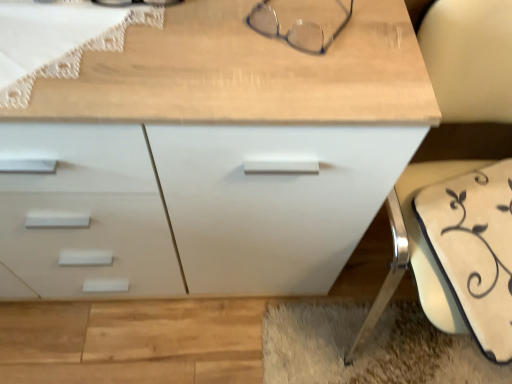
Describe the element at coordinates (246, 74) in the screenshot. This screenshot has width=512, height=384. I see `white matte chest of drawers at center` at that location.

The width and height of the screenshot is (512, 384). Describe the element at coordinates (454, 250) in the screenshot. I see `white fabric swivel chair at lower right` at that location.

Find the location of `white fabric swivel chair at lower right`. white fabric swivel chair at lower right is located at coordinates click(454, 250).

At what (x,y) coordinates should I click in order to perform the action: click on clear plastic glasses at upper center. Please return your answer as a coordinate pair (x, y). Looking at the image, I should click on (298, 25).

Measure the distance from white matte chest of drawers at center to clear plastic glasses at upper center.

white matte chest of drawers at center and clear plastic glasses at upper center are 4.26 inches apart from each other.

Does white matte chest of drawers at center have a lesser height compared to clear plastic glasses at upper center?

In fact, white matte chest of drawers at center may be taller than clear plastic glasses at upper center.

Looking at this image, which object is thinner, white matte chest of drawers at center or clear plastic glasses at upper center?

clear plastic glasses at upper center is thinner.

Which of these two, white matte chest of drawers at center or clear plastic glasses at upper center, is bigger?

white matte chest of drawers at center.

Considering the relative positions of clear plastic glasses at upper center and white fabric swivel chair at lower right in the image provided, is clear plastic glasses at upper center to the left or to the right of white fabric swivel chair at lower right?

In the image, clear plastic glasses at upper center appears on the left side of white fabric swivel chair at lower right.

From the image's perspective, which is below, clear plastic glasses at upper center or white fabric swivel chair at lower right?

From the image's view, white fabric swivel chair at lower right is below.

You are a GUI agent. You are given a task and a screenshot of the screen. Output one action in this format:
    pyautogui.click(x=<x>, y=<y>)
    Task: Click on the glasses lying above the white fabric swivel chair at lower right (from the image's perspective)
    Image resolution: width=512 pixels, height=384 pixels.
    Given the screenshot: What is the action you would take?
    pyautogui.click(x=298, y=25)

Is point (293, 13) more distant than point (492, 218)?

No, it is in front of (492, 218).

Considering their positions, is clear plastic glasses at upper center located in front of or behind white matte chest of drawers at center?

Clearly, clear plastic glasses at upper center is behind white matte chest of drawers at center.

Does clear plastic glasses at upper center have a greater height compared to white matte chest of drawers at center?

No, clear plastic glasses at upper center is not taller than white matte chest of drawers at center.

From the image's perspective, is clear plastic glasses at upper center located above or below white matte chest of drawers at center?

clear plastic glasses at upper center is above white matte chest of drawers at center.

From the image's perspective, is white fabric swivel chair at lower right under white matte chest of drawers at center?

Yes, from the image's perspective, white fabric swivel chair at lower right is beneath white matte chest of drawers at center.

Does white fabric swivel chair at lower right turn towards white matte chest of drawers at center?

No, white fabric swivel chair at lower right is not facing towards white matte chest of drawers at center.

Does white fabric swivel chair at lower right have a lesser height compared to white matte chest of drawers at center?

In fact, white fabric swivel chair at lower right may be taller than white matte chest of drawers at center.

In the image, there is a white fabric swivel chair at lower right. Where is `the chest of drawers below it (from a real-world perspective)`? The width and height of the screenshot is (512, 384). the chest of drawers below it (from a real-world perspective) is located at coordinates (246, 74).

From a real-world perspective, is white matte chest of drawers at center under white fabric swivel chair at lower right?

Yes, from a real-world perspective, white matte chest of drawers at center is below white fabric swivel chair at lower right.

Can you tell me how much white matte chest of drawers at center and white fabric swivel chair at lower right differ in facing direction?

3.08e-05 degrees separate the facing orientations of white matte chest of drawers at center and white fabric swivel chair at lower right.

Looking at this image, is white matte chest of drawers at center spatially inside white fabric swivel chair at lower right, or outside of it?

white matte chest of drawers at center is spatially situated outside white fabric swivel chair at lower right.

I want to click on chest of drawers on the left of white fabric swivel chair at lower right, so click(246, 74).

Does white fabric swivel chair at lower right appear on the right side of clear plastic glasses at upper center?

Correct, you'll find white fabric swivel chair at lower right to the right of clear plastic glasses at upper center.

Does white fabric swivel chair at lower right turn towards clear plastic glasses at upper center?

No, white fabric swivel chair at lower right is not aimed at clear plastic glasses at upper center.

Identify the location of glasses above the white fabric swivel chair at lower right (from a real-world perspective). (298, 25).

Find the location of a particular element. This screenshot has width=512, height=384. glasses on the right of white matte chest of drawers at center is located at coordinates (298, 25).

This screenshot has width=512, height=384. Find the location of `glasses on the left of white fabric swivel chair at lower right`. glasses on the left of white fabric swivel chair at lower right is located at coordinates (298, 25).

From the image, which object appears to be nearer to white matte chest of drawers at center, clear plastic glasses at upper center or white fabric swivel chair at lower right?

clear plastic glasses at upper center.

Which object lies further to the anchor point clear plastic glasses at upper center, white fabric swivel chair at lower right or white matte chest of drawers at center?

Based on the image, white fabric swivel chair at lower right appears to be further to clear plastic glasses at upper center.

Considering their positions, is white fabric swivel chair at lower right positioned closer to white matte chest of drawers at center than clear plastic glasses at upper center?

clear plastic glasses at upper center.

Looking at this image, when comparing their distances from white fabric swivel chair at lower right, does clear plastic glasses at upper center or white matte chest of drawers at center seem further?

clear plastic glasses at upper center is positioned further to the anchor white fabric swivel chair at lower right.

From the image, which object appears to be farther from clear plastic glasses at upper center, white matte chest of drawers at center or white fabric swivel chair at lower right?

white fabric swivel chair at lower right.

Considering their positions, is white matte chest of drawers at center positioned closer to white fabric swivel chair at lower right than clear plastic glasses at upper center?

Among the two, white matte chest of drawers at center is located nearer to white fabric swivel chair at lower right.

Where is `glasses between white matte chest of drawers at center and white fabric swivel chair at lower right`? This screenshot has height=384, width=512. glasses between white matte chest of drawers at center and white fabric swivel chair at lower right is located at coordinates (298, 25).